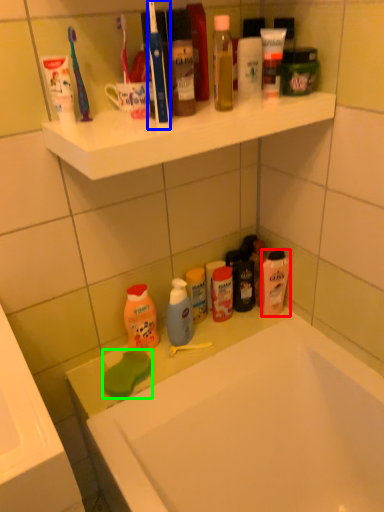
Question: Which object is positioned farthest from mouthwash (highlighted by a red box)? Select from toothbrush (highlighted by a blue box) and soap (highlighted by a green box).

Choices:
 (A) toothbrush
 (B) soap

Answer: (A)